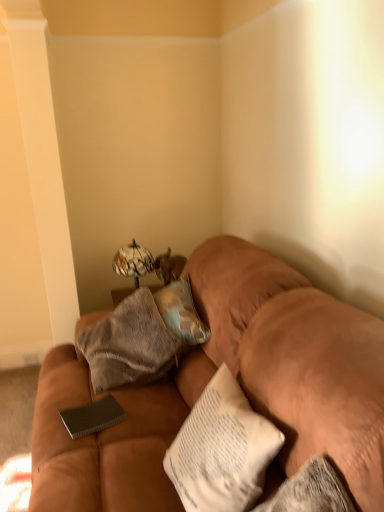
Question: In terms of width, does black textured notebook at center look wider or thinner when compared to textured beige pillow at center?

Choices:
 (A) wide
 (B) thin

Answer: (A)

Question: From the image's perspective, is black textured notebook at center located above or below textured beige pillow at center?

Choices:
 (A) below
 (B) above

Answer: (A)

Question: Estimate the real-world distances between objects in this image. Which object is closer to the textured beige pillow at center?

Choices:
 (A) suede brown couch at center
 (B) black textured notebook at center
 (C) marble-patterned glass table lamp at upper center

Answer: (A)

Question: Which is nearer to the suede brown couch at center?

Choices:
 (A) marble-patterned glass table lamp at upper center
 (B) textured beige pillow at center
 (C) black textured notebook at center

Answer: (B)